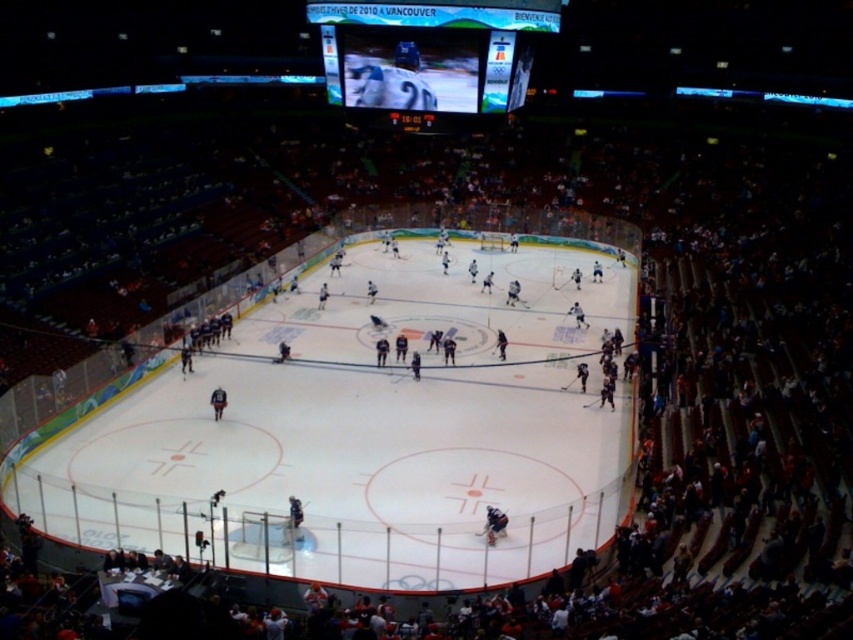
Question: Which object is farther from the camera taking this photo?

Choices:
 (A) white glossy scoreboard at upper center
 (B) white smooth ice at center
 (C) dark blue jersey at center

Answer: (A)

Question: Among these objects, which one is nearest to the camera?

Choices:
 (A) dark blue jersey at center
 (B) white glossy scoreboard at upper center

Answer: (A)

Question: Is white smooth ice at center to the right of dark blue jersey at center from the viewer's perspective?

Choices:
 (A) no
 (B) yes

Answer: (A)

Question: Which point is closer to the camera?

Choices:
 (A) (465, 44)
 (B) (497, 516)

Answer: (B)

Question: Is white smooth ice at center wider than dark blue jersey at center?

Choices:
 (A) yes
 (B) no

Answer: (A)

Question: Is white smooth ice at center behind dark blue jersey at center?

Choices:
 (A) no
 (B) yes

Answer: (A)